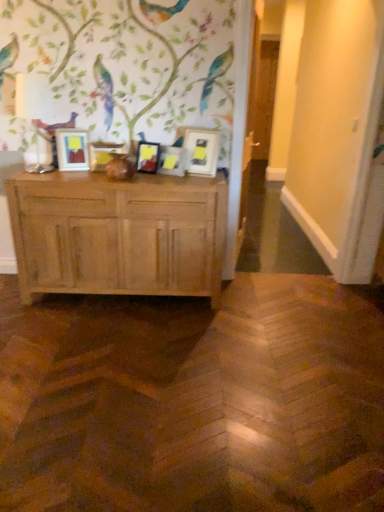
Locate an element on the screen. matte wooden picture frame at left, arranged as the first picture frame when viewed from the left is located at coordinates (72, 149).

What do you see at coordinates (118, 234) in the screenshot?
I see `light brown wood chest of drawers at center` at bounding box center [118, 234].

The image size is (384, 512). In order to click on matte wooden picture frame at left, the fifth picture frame from the right in this screenshot , I will do `click(72, 149)`.

From a real-world perspective, is matte wooden picture frame at center, which appears as the third picture frame when viewed from the right, over matte white picture frame at center, the second picture frame when ordered from right to left?

Yes, from a real-world perspective, matte wooden picture frame at center, which appears as the third picture frame when viewed from the right, is on top of matte white picture frame at center, the second picture frame when ordered from right to left.

Is matte wooden picture frame at center, which ranks as the third picture frame in left-to-right order, positioned beyond the bounds of matte white picture frame at center, the second picture frame when ordered from right to left?

Indeed, matte wooden picture frame at center, which ranks as the third picture frame in left-to-right order, is completely outside matte white picture frame at center, the second picture frame when ordered from right to left.

Can you confirm if matte wooden picture frame at center, which appears as the third picture frame when viewed from the right, is positioned to the right of matte white picture frame at center, the second picture frame when ordered from right to left?

In fact, matte wooden picture frame at center, which appears as the third picture frame when viewed from the right, is to the left of matte white picture frame at center, the second picture frame when ordered from right to left.

From a real-world perspective, count 2nd picture frames upward from the matte white picture frame at center, marked as the fourth picture frame in a left-to-right arrangement, and point to it. Please provide its 2D coordinates.

[(147, 157)]

Consider the image. Is matte wooden picture frame at center, which is the 2th picture frame from left to right, taller than matte wooden picture frame at center, which ranks as the third picture frame in left-to-right order?

In fact, matte wooden picture frame at center, which is the 2th picture frame from left to right, may be shorter than matte wooden picture frame at center, which ranks as the third picture frame in left-to-right order.

Can you tell me how much matte wooden picture frame at center, which appears as the fourth picture frame when viewed from the right, and matte wooden picture frame at center, which ranks as the third picture frame in left-to-right order, differ in facing direction?

30.6 degrees separate the facing orientations of matte wooden picture frame at center, which appears as the fourth picture frame when viewed from the right, and matte wooden picture frame at center, which ranks as the third picture frame in left-to-right order.

From a real-world perspective, between matte wooden picture frame at center, which is the 2th picture frame from left to right, and matte wooden picture frame at center, which ranks as the third picture frame in left-to-right order, who is vertically lower?

matte wooden picture frame at center, which is the 2th picture frame from left to right, is physically lower.

Measure the distance between matte wooden picture frame at center, which appears as the third picture frame when viewed from the right, and matte white picture frame at center, which ranks as the 5th picture frame in left-to-right order.

matte wooden picture frame at center, which appears as the third picture frame when viewed from the right, and matte white picture frame at center, which ranks as the 5th picture frame in left-to-right order, are 10.83 inches apart.

From a real-world perspective, starting from the matte wooden picture frame at center, which ranks as the third picture frame in left-to-right order, which picture frame is the 2nd one vertically above it? Please provide its 2D coordinates.

[(201, 151)]

Does point (151, 150) come farther from viewer compared to point (202, 158)?

Yes, it is behind point (202, 158).

Considering the relative positions of matte wooden picture frame at center, which ranks as the third picture frame in left-to-right order, and matte white picture frame at center, the 1th picture frame in the right-to-left sequence, in the image provided, is matte wooden picture frame at center, which ranks as the third picture frame in left-to-right order, to the left of matte white picture frame at center, the 1th picture frame in the right-to-left sequence, from the viewer's perspective?

Correct, you'll find matte wooden picture frame at center, which ranks as the third picture frame in left-to-right order, to the left of matte white picture frame at center, the 1th picture frame in the right-to-left sequence.

Which is in front, matte wooden picture frame at center, which appears as the fourth picture frame when viewed from the right, or matte wooden picture frame at left, the fifth picture frame from the right?

matte wooden picture frame at left, the fifth picture frame from the right.

The image size is (384, 512). I want to click on the 3rd picture frame in front of the matte wooden picture frame at center, which appears as the fourth picture frame when viewed from the right, counting from the anchor's position, so click(72, 149).

Is matte wooden picture frame at center, which appears as the fourth picture frame when viewed from the right, thinner than matte wooden picture frame at left, the fifth picture frame from the right?

Indeed, matte wooden picture frame at center, which appears as the fourth picture frame when viewed from the right, has a lesser width compared to matte wooden picture frame at left, the fifth picture frame from the right.

How different are the orientations of matte wooden picture frame at center, which is the 2th picture frame from left to right, and matte wooden picture frame at left, the fifth picture frame from the right, in degrees?

The facing directions of matte wooden picture frame at center, which is the 2th picture frame from left to right, and matte wooden picture frame at left, the fifth picture frame from the right, are 9.05 degrees apart.

Which of these two, matte white picture frame at center, the 1th picture frame in the right-to-left sequence, or light brown wood chest of drawers at center, is bigger?

With larger size is light brown wood chest of drawers at center.

Is matte white picture frame at center, the 1th picture frame in the right-to-left sequence, located outside light brown wood chest of drawers at center?

matte white picture frame at center, the 1th picture frame in the right-to-left sequence, is positioned outside light brown wood chest of drawers at center.

Is point (186, 167) farther from camera compared to point (215, 189)?

Yes.

Between matte white picture frame at center, which ranks as the 5th picture frame in left-to-right order, and light brown wood chest of drawers at center, which one is positioned behind?

matte white picture frame at center, which ranks as the 5th picture frame in left-to-right order, is behind.

Is matte white picture frame at center, which ranks as the 5th picture frame in left-to-right order, inside the boundaries of matte wooden picture frame at center, which appears as the fourth picture frame when viewed from the right, or outside?

matte white picture frame at center, which ranks as the 5th picture frame in left-to-right order, is spatially situated outside matte wooden picture frame at center, which appears as the fourth picture frame when viewed from the right.

From a real-world perspective, is matte white picture frame at center, the 1th picture frame in the right-to-left sequence, above or below matte wooden picture frame at center, which appears as the fourth picture frame when viewed from the right?

matte white picture frame at center, the 1th picture frame in the right-to-left sequence, is above matte wooden picture frame at center, which appears as the fourth picture frame when viewed from the right.

Considering the sizes of objects matte white picture frame at center, which ranks as the 5th picture frame in left-to-right order, and matte wooden picture frame at center, which is the 2th picture frame from left to right, in the image provided, who is taller, matte white picture frame at center, which ranks as the 5th picture frame in left-to-right order, or matte wooden picture frame at center, which is the 2th picture frame from left to right,?

Standing taller between the two is matte white picture frame at center, which ranks as the 5th picture frame in left-to-right order.

Is the depth of matte wooden picture frame at center, which appears as the fourth picture frame when viewed from the right, greater than that of matte white picture frame at center, the second picture frame when ordered from right to left?

Yes, matte wooden picture frame at center, which appears as the fourth picture frame when viewed from the right, is further from the camera.

Looking at this image, from the image's perspective, who appears lower, matte wooden picture frame at center, which appears as the fourth picture frame when viewed from the right, or matte white picture frame at center, the second picture frame when ordered from right to left?

From the image's view, matte white picture frame at center, the second picture frame when ordered from right to left, is below.

Would you say matte wooden picture frame at center, which appears as the fourth picture frame when viewed from the right, is inside or outside matte white picture frame at center, marked as the fourth picture frame in a left-to-right arrangement?

matte wooden picture frame at center, which appears as the fourth picture frame when viewed from the right, exists outside the volume of matte white picture frame at center, marked as the fourth picture frame in a left-to-right arrangement.

At what (x,y) coordinates should I click in order to perform the action: click on the 2nd picture frame above the matte white picture frame at center, marked as the fourth picture frame in a left-to-right arrangement (from a real-world perspective). Please return your answer as a coordinate pair (x, y). Looking at the image, I should click on (147, 157).

This screenshot has width=384, height=512. What are the coordinates of `picture frame behind the matte wooden picture frame at center, which ranks as the third picture frame in left-to-right order` in the screenshot? It's located at (103, 154).

Consider the image. When comparing their distances from light brown wood chest of drawers at center, does matte wooden picture frame at center, which is the 2th picture frame from left to right, or matte white picture frame at center, marked as the fourth picture frame in a left-to-right arrangement, seem closer?

The object closer to light brown wood chest of drawers at center is matte wooden picture frame at center, which is the 2th picture frame from left to right.

Based on their spatial positions, is matte white picture frame at center, marked as the fourth picture frame in a left-to-right arrangement, or light brown wood chest of drawers at center further from matte wooden picture frame at left, the fifth picture frame from the right?

Among the two, light brown wood chest of drawers at center is located further to matte wooden picture frame at left, the fifth picture frame from the right.

Considering their positions, is matte wooden picture frame at center, which appears as the fourth picture frame when viewed from the right, positioned further to matte white picture frame at center, the 1th picture frame in the right-to-left sequence, than matte wooden picture frame at left, the fifth picture frame from the right?

matte wooden picture frame at left, the fifth picture frame from the right, is further to matte white picture frame at center, the 1th picture frame in the right-to-left sequence.

Based on their spatial positions, is matte white picture frame at center, marked as the fourth picture frame in a left-to-right arrangement, or matte white picture frame at center, the 1th picture frame in the right-to-left sequence, closer to matte wooden picture frame at center, which ranks as the third picture frame in left-to-right order?

matte white picture frame at center, marked as the fourth picture frame in a left-to-right arrangement.

Based on their spatial positions, is matte wooden picture frame at left, arranged as the first picture frame when viewed from the left, or matte wooden picture frame at center, which appears as the third picture frame when viewed from the right, further from matte white picture frame at center, marked as the fourth picture frame in a left-to-right arrangement?

Among the two, matte wooden picture frame at left, arranged as the first picture frame when viewed from the left, is located further to matte white picture frame at center, marked as the fourth picture frame in a left-to-right arrangement.

When comparing their distances from matte wooden picture frame at center, which appears as the fourth picture frame when viewed from the right, does matte wooden picture frame at center, which appears as the third picture frame when viewed from the right, or matte white picture frame at center, the 1th picture frame in the right-to-left sequence, seem closer?

matte wooden picture frame at center, which appears as the third picture frame when viewed from the right, is closer to matte wooden picture frame at center, which appears as the fourth picture frame when viewed from the right.

When comparing their distances from matte wooden picture frame at center, which is the 2th picture frame from left to right, does matte wooden picture frame at left, the fifth picture frame from the right, or matte white picture frame at center, the 1th picture frame in the right-to-left sequence, seem closer?

matte wooden picture frame at left, the fifth picture frame from the right.

Based on their spatial positions, is matte wooden picture frame at center, which is the 2th picture frame from left to right, or light brown wood chest of drawers at center closer to matte wooden picture frame at center, which ranks as the third picture frame in left-to-right order?

matte wooden picture frame at center, which is the 2th picture frame from left to right.

The width and height of the screenshot is (384, 512). I want to click on picture frame between matte wooden picture frame at center, which appears as the third picture frame when viewed from the right, and light brown wood chest of drawers at center vertically, so [x=172, y=161].

Locate an element on the screen. picture frame between matte wooden picture frame at center, which appears as the third picture frame when viewed from the right, and matte white picture frame at center, which ranks as the 5th picture frame in left-to-right order, in the horizontal direction is located at coordinates (172, 161).

Where is `picture frame situated between matte wooden picture frame at left, the fifth picture frame from the right, and matte wooden picture frame at center, which ranks as the third picture frame in left-to-right order, from left to right`? The width and height of the screenshot is (384, 512). picture frame situated between matte wooden picture frame at left, the fifth picture frame from the right, and matte wooden picture frame at center, which ranks as the third picture frame in left-to-right order, from left to right is located at coordinates (103, 154).

Where is `the chest of drawers located between matte wooden picture frame at left, arranged as the first picture frame when viewed from the left, and matte white picture frame at center, the second picture frame when ordered from right to left, in the left-right direction`? This screenshot has height=512, width=384. the chest of drawers located between matte wooden picture frame at left, arranged as the first picture frame when viewed from the left, and matte white picture frame at center, the second picture frame when ordered from right to left, in the left-right direction is located at coordinates (118, 234).